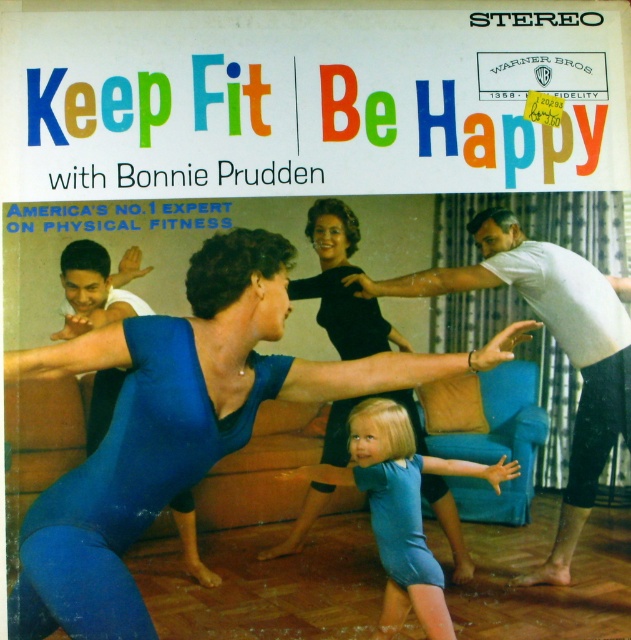
Question: Which object is farther from the camera taking this photo?

Choices:
 (A) blue fabric child at center
 (B) blue denim shorts at center
 (C) blue spandex leotard at center

Answer: (C)

Question: Can you confirm if blue spandex leotard at center is bigger than blue fabric child at center?

Choices:
 (A) yes
 (B) no

Answer: (A)

Question: Which point is farther to the camera?

Choices:
 (A) (54, 333)
 (B) (360, 348)

Answer: (B)

Question: Which of the following is the farthest from the observer?

Choices:
 (A) (187, 536)
 (B) (415, 566)
 (C) (334, 413)

Answer: (C)

Question: Where is blue spandex leotard at center located in relation to blue denim shorts at center in the image?

Choices:
 (A) below
 (B) above

Answer: (B)

Question: Can you confirm if blue spandex leotard at center is smaller than blue fabric child at center?

Choices:
 (A) no
 (B) yes

Answer: (A)